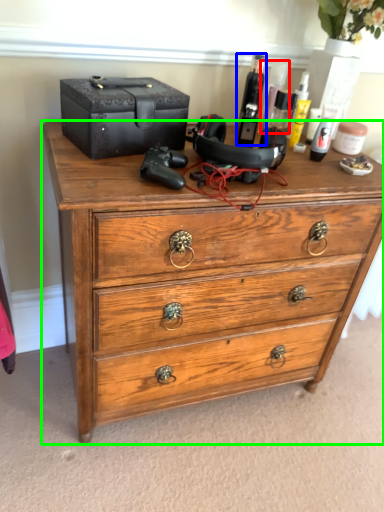
Question: Which is farther away from toiletry (highlighted by a red box)? toiletry (highlighted by a blue box) or chest of drawers (highlighted by a green box)?

Choices:
 (A) toiletry
 (B) chest of drawers

Answer: (B)